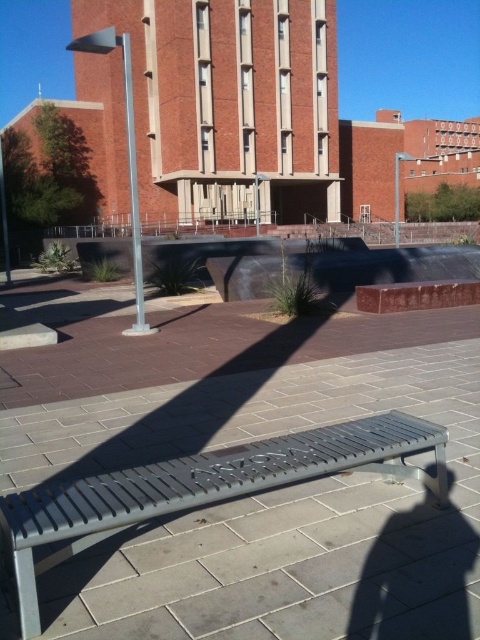
Who is shorter, gray metal bench at center or metallic gray pole at center?

gray metal bench at center is shorter.

Can you confirm if gray metal bench at center is wider than metallic gray pole at center?

In fact, gray metal bench at center might be narrower than metallic gray pole at center.

Does point (64, 454) come behind point (396, 225)?

No.

Where is `gray metal bench at center`? The image size is (480, 640). gray metal bench at center is located at coordinates (269, 509).

Can you confirm if gray metal bench at center is smaller than silver metallic pole at left?

Indeed, gray metal bench at center has a smaller size compared to silver metallic pole at left.

Measure the distance from gray metal bench at center to silver metallic pole at left.

A distance of 16.25 feet exists between gray metal bench at center and silver metallic pole at left.

Where is `gray metal bench at center`? Image resolution: width=480 pixels, height=640 pixels. gray metal bench at center is located at coordinates (269, 509).

You are a GUI agent. You are given a task and a screenshot of the screen. Output one action in this format:
    pyautogui.click(x=<x>, y=<y>)
    Task: Click on the gray metal bench at center
    This screenshot has height=640, width=480.
    Given the screenshot: What is the action you would take?
    point(269,509)

Who is shorter, silver metallic pole at left or metallic gray pole at center?

metallic gray pole at center

Does silver metallic pole at left lie in front of metallic gray pole at center?

Yes, silver metallic pole at left is in front of metallic gray pole at center.

Locate an element on the screen. The width and height of the screenshot is (480, 640). silver metallic pole at left is located at coordinates (132, 193).

Find the location of `silver metallic pole at left`. silver metallic pole at left is located at coordinates (132, 193).